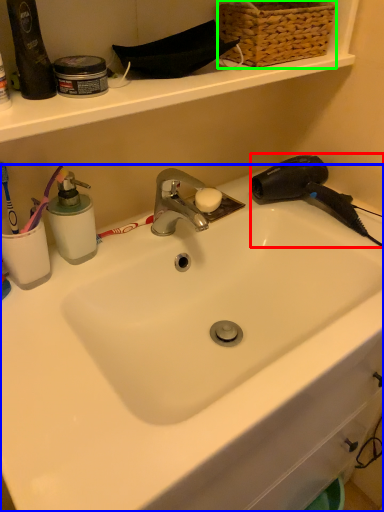
Question: Based on their relative distances, which object is nearer to hair drier (highlighted by a red box)? Choose from sink (highlighted by a blue box) and basket (highlighted by a green box).

Choices:
 (A) sink
 (B) basket

Answer: (B)